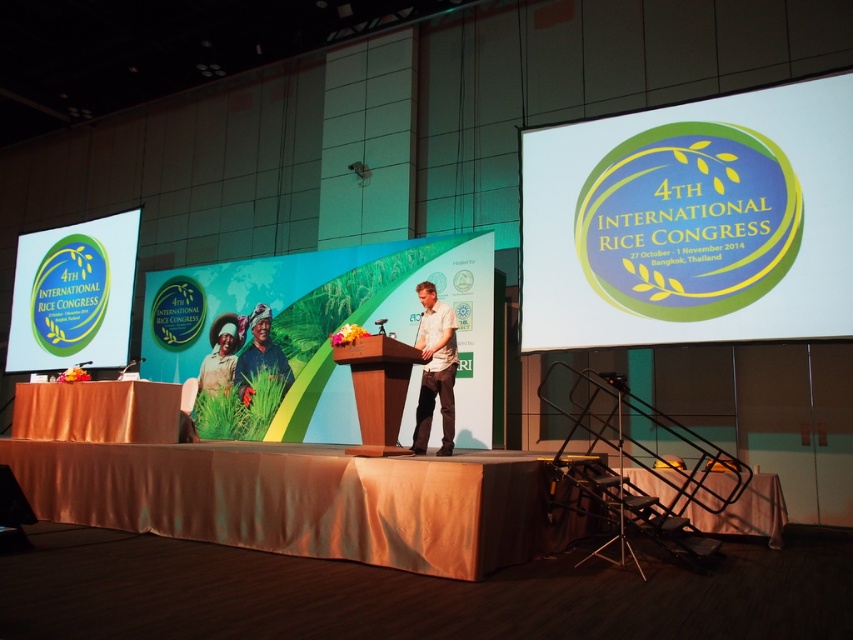
Question: Does orange fabric table at center have a greater width compared to metallic silver table at center?

Choices:
 (A) yes
 (B) no

Answer: (A)

Question: Does orange fabric table at lower left come behind wooden podium at center?

Choices:
 (A) yes
 (B) no

Answer: (A)

Question: Estimate the real-world distances between objects in this image. Which object is closer to the wooden podium at center?

Choices:
 (A) white cotton shirt at center
 (B) orange fabric table at lower left

Answer: (A)

Question: Which of the following is the farthest from the observer?

Choices:
 (A) (706, 172)
 (B) (426, 323)
 (C) (357, 397)

Answer: (A)

Question: Which of these objects is positioned farthest from the orange fabric table at center?

Choices:
 (A) matte black shirt at center
 (B) matte brown fabric at center
 (C) white cotton shirt at center
 (D) wooden podium at center

Answer: (B)

Question: From the image, what is the correct spatial relationship of metallic silver table at center in relation to matte brown fabric at center?

Choices:
 (A) left
 (B) right

Answer: (B)